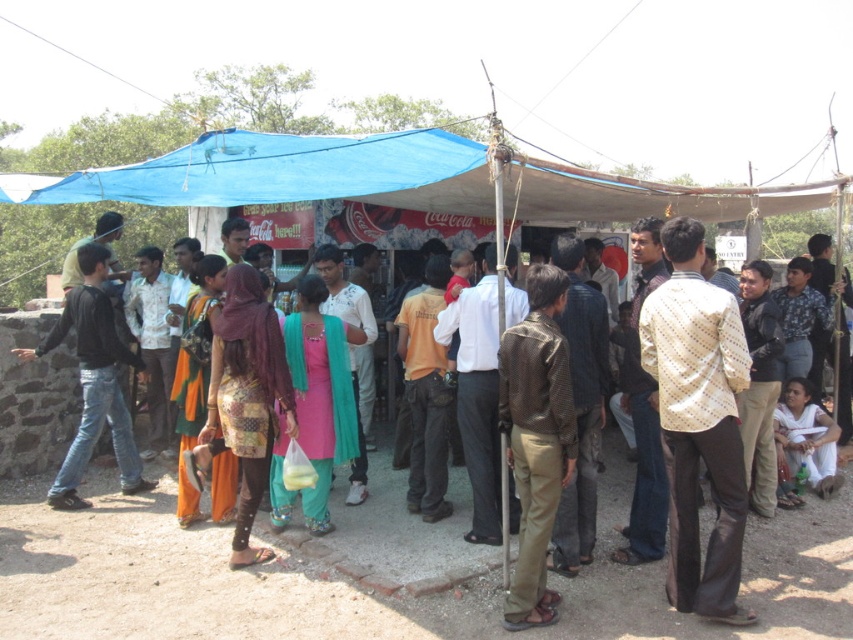
Between light beige dotted shirt at center and white cotton dress at lower right, which one is positioned higher?

light beige dotted shirt at center is above.

Does light beige dotted shirt at center have a larger size compared to white cotton dress at lower right?

Yes, light beige dotted shirt at center is bigger than white cotton dress at lower right.

The width and height of the screenshot is (853, 640). What do you see at coordinates (698, 420) in the screenshot? I see `light beige dotted shirt at center` at bounding box center [698, 420].

You are a GUI agent. You are given a task and a screenshot of the screen. Output one action in this format:
    pyautogui.click(x=<x>, y=<y>)
    Task: Click on the light beige dotted shirt at center
    
    Given the screenshot: What is the action you would take?
    pyautogui.click(x=698, y=420)

Is brown textured shirt at center shorter than white cotton dress at lower right?

No, brown textured shirt at center is not shorter than white cotton dress at lower right.

Between brown textured shirt at center and white cotton dress at lower right, which one appears on the left side from the viewer's perspective?

Positioned to the left is brown textured shirt at center.

Is point (520, 564) in front of point (814, 413)?

Yes, it is.

Locate an element on the screen. This screenshot has height=640, width=853. brown textured shirt at center is located at coordinates (537, 438).

Between light beige dotted shirt at center and brown textured shirt at center, which one is positioned lower?

brown textured shirt at center is lower down.

Can you confirm if light beige dotted shirt at center is bigger than brown textured shirt at center?

Indeed, light beige dotted shirt at center has a larger size compared to brown textured shirt at center.

Between point (693, 260) and point (544, 356), which one is positioned behind?

The point (693, 260) is behind.

At what (x,y) coordinates should I click in order to perform the action: click on light beige dotted shirt at center. Please return your answer as a coordinate pair (x, y). The height and width of the screenshot is (640, 853). Looking at the image, I should click on (698, 420).